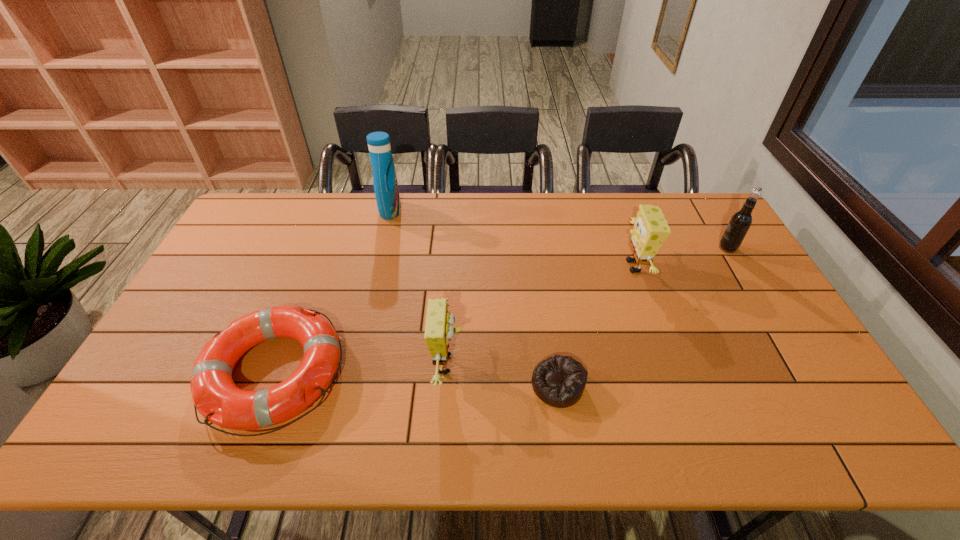
The image size is (960, 540). In order to click on free space that is in between the fifth tallest object and the beanbag in this screenshot , I will do (x=416, y=379).

In order to click on blank region between the right sponge and the beanbag in this screenshot , I will do `click(596, 326)`.

This screenshot has height=540, width=960. I want to click on blank region between the nearer sponge and the farther sponge, so click(x=541, y=315).

Locate an element on the screen. free spot between the detergent and the left sponge is located at coordinates (419, 287).

You are a GUI agent. You are given a task and a screenshot of the screen. Output one action in this format:
    pyautogui.click(x=<x>, y=<y>)
    Task: Click on the empty location between the third object from left to right and the detergent
    The height and width of the screenshot is (540, 960).
    Given the screenshot: What is the action you would take?
    pyautogui.click(x=419, y=287)

Image resolution: width=960 pixels, height=540 pixels. I want to click on free space between the beanbag and the tallest object, so click(x=474, y=298).

Where is `vacant space that's between the root beer and the left sponge`? The width and height of the screenshot is (960, 540). vacant space that's between the root beer and the left sponge is located at coordinates (588, 306).

Find the location of a particular element. vacant space in between the life buoy and the detergent is located at coordinates (332, 292).

Find the location of a particular element. the fourth closest object to the life buoy is located at coordinates (651, 229).

Find the location of a particular element. Image resolution: width=960 pixels, height=540 pixels. object that is the fourth closest one to the second shortest object is located at coordinates (651, 229).